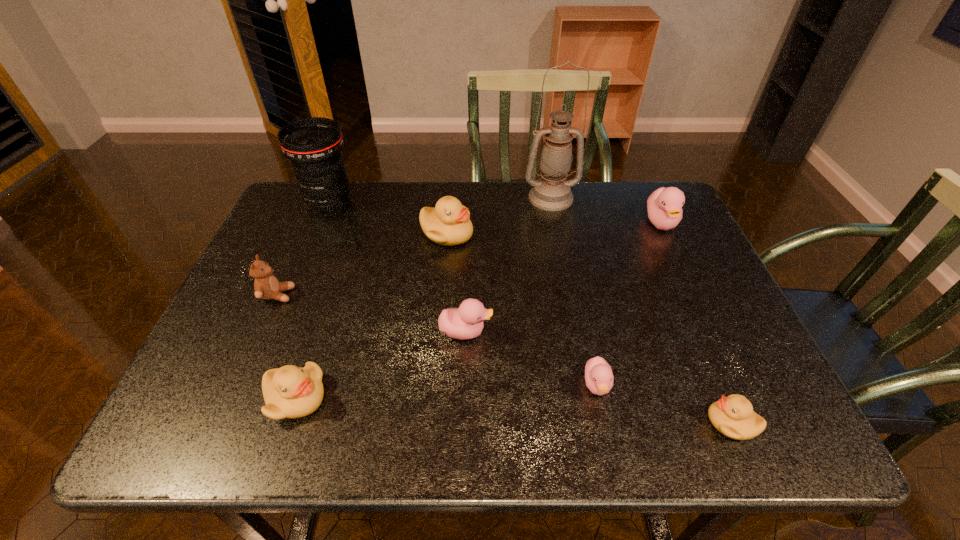
You are a GUI agent. You are given a task and a screenshot of the screen. Output one action in this format:
    pyautogui.click(x=<x>, y=<y>)
    Task: Click on the free space located 0.150m on the beak of the second yellow duckling from right to left
    The width and height of the screenshot is (960, 540).
    Given the screenshot: What is the action you would take?
    pyautogui.click(x=527, y=234)

This screenshot has height=540, width=960. I want to click on vacant space located 0.190m on the front-facing side of the brown teddy bear, so click(x=372, y=295).

Where is `free point located on the front-facing side of the third farthest duckling`? The height and width of the screenshot is (540, 960). free point located on the front-facing side of the third farthest duckling is located at coordinates (604, 332).

Locate an element on the screen. This screenshot has height=540, width=960. vacant space located on the beak of the leftmost yellow duckling is located at coordinates (457, 399).

Find the location of a particular element. vacant space situated on the beak of the smallest yellow duckling is located at coordinates (582, 422).

Image resolution: width=960 pixels, height=540 pixels. I want to click on vacant region located on the beak of the smallest yellow duckling, so click(x=608, y=422).

Where is `free space located on the beak of the smallest yellow duckling`? The image size is (960, 540). free space located on the beak of the smallest yellow duckling is located at coordinates (592, 422).

You are a GUI agent. You are given a task and a screenshot of the screen. Output one action in this format:
    pyautogui.click(x=<x>, y=<y>)
    Task: Click on the oil lamp present at the far edge
    
    Given the screenshot: What is the action you would take?
    pyautogui.click(x=552, y=192)

You are a GUI agent. You are given a task and a screenshot of the screen. Output one action in this format:
    pyautogui.click(x=<x>, y=<y>)
    Task: Click on the telephoto lens that is at the far edge
    
    Given the screenshot: What is the action you would take?
    pyautogui.click(x=314, y=145)

Where is `telephoto lens positioned at the left edge`? The width and height of the screenshot is (960, 540). telephoto lens positioned at the left edge is located at coordinates (314, 145).